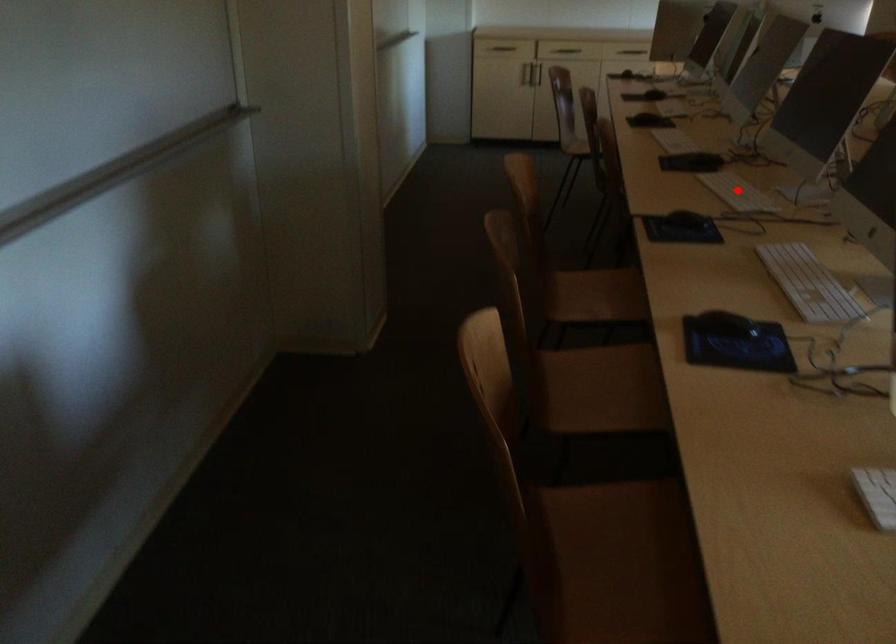
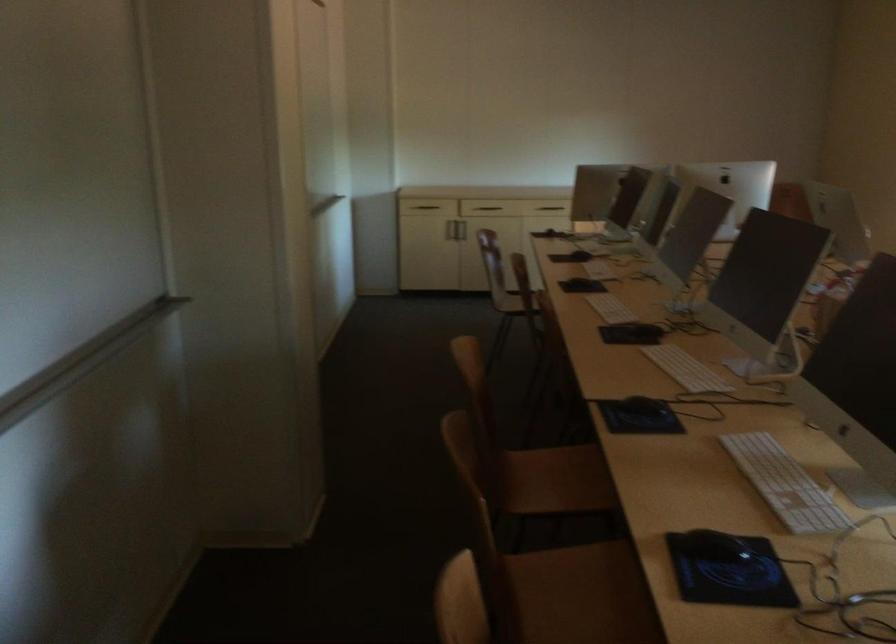
Locate, in the second image, the point that corresponds to the highlighted location in the first image.

(685, 368)